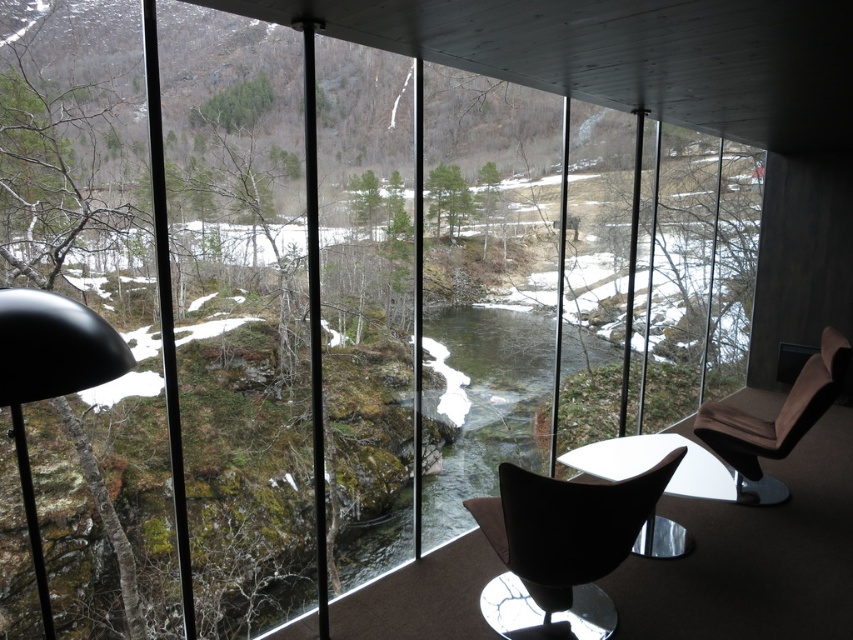
You are planning to rearrange the furniture in the room. If you want to move the matte black lamp at left closer to the velvet brown armchair at right, will you have enough space between them to walk comfortably?

The matte black lamp at left occupies less space than the velvet brown armchair at right, so there should be enough space between them to walk comfortably since the lamp takes up less area.

You are a guest in this room and want to sit in the matte black swivel chair at center. To do so, you need to walk around the matte black lamp at left, which is in your way. Since the lamp is taller than the chair, can you easily step over it?

The matte black swivel chair at center is not as tall as the matte black lamp at left, so the lamp is taller. Since the lamp is taller than the chair, it might be difficult to step over it easily, so you should move around it instead.

You are standing in the room and looking through the large windows. There are two points marked in the scene outside. The first point is at coordinates point (519,588) and the second is at point (785,413). From your vantage point inside the room, which of these two points is closer to you?

Point (519,588) is in front of point (785,413), so it is closer to you.